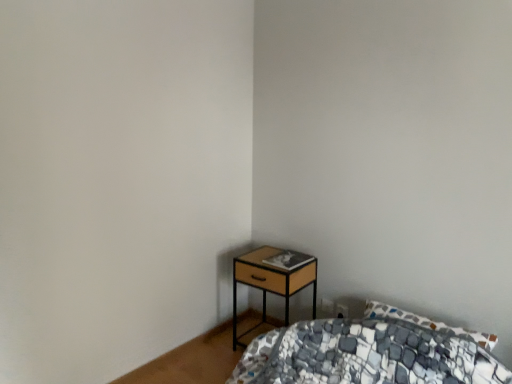
You are a GUI agent. You are given a task and a screenshot of the screen. Output one action in this format:
    pyautogui.click(x=<x>, y=<y>)
    Task: Click on the woodenmaterial/texturenightstand at lower right
    This screenshot has height=384, width=512.
    Given the screenshot: What is the action you would take?
    pyautogui.click(x=270, y=282)

The image size is (512, 384). Describe the element at coordinates (270, 282) in the screenshot. I see `woodenmaterial/texturenightstand at lower right` at that location.

Where is `woodenmaterial/texturenightstand at lower right`? The height and width of the screenshot is (384, 512). woodenmaterial/texturenightstand at lower right is located at coordinates (270, 282).